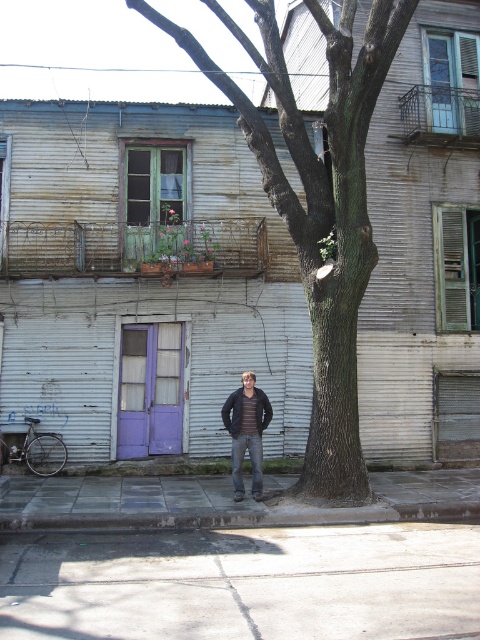
In the scene shown: Does gray concrete curb at lower center appear over dark gray jacket at center?

Actually, gray concrete curb at lower center is below dark gray jacket at center.

Which of these two, gray concrete curb at lower center or dark gray jacket at center, stands shorter?

gray concrete curb at lower center

Does point (236, 513) come behind point (237, 497)?

No, it is in front of (237, 497).

The height and width of the screenshot is (640, 480). Identify the location of gray concrete curb at lower center. [x=244, y=516].

Find the location of `smooth bark tree at center`. smooth bark tree at center is located at coordinates (319, 205).

Which is behind, point (290, 100) or point (239, 474)?

Positioned behind is point (239, 474).

Between point (348, 394) and point (250, 448), which one is positioned in front?

Point (348, 394)

The height and width of the screenshot is (640, 480). Identify the location of smooth bark tree at center. (319, 205).

Is smooth bark tree at center taller than gray concrete curb at lower center?

Correct, smooth bark tree at center is much taller as gray concrete curb at lower center.

Is smooth bark tree at center to the left of gray concrete curb at lower center from the viewer's perspective?

In fact, smooth bark tree at center is to the right of gray concrete curb at lower center.

Does point (333, 138) come in front of point (332, 515)?

No, (333, 138) is further to viewer.

Identify the location of smooth bark tree at center. This screenshot has width=480, height=640. (319, 205).